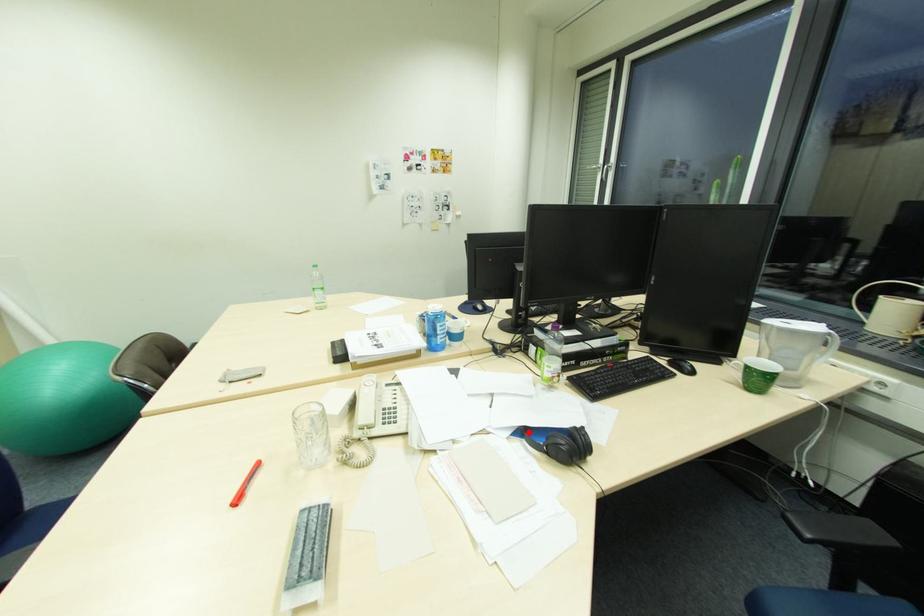
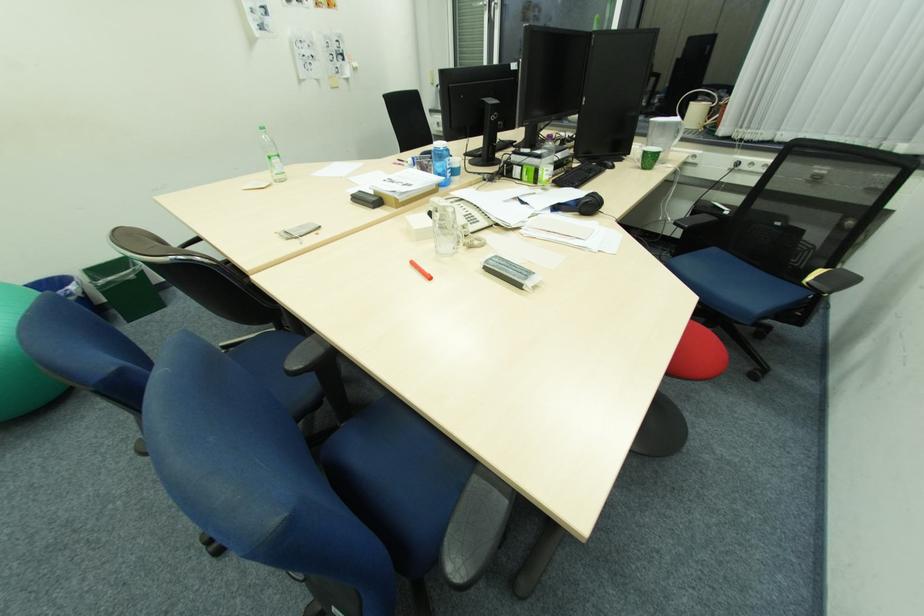
Locate, in the second image, the point that corresponds to the highlighted location in the first image.

(563, 209)